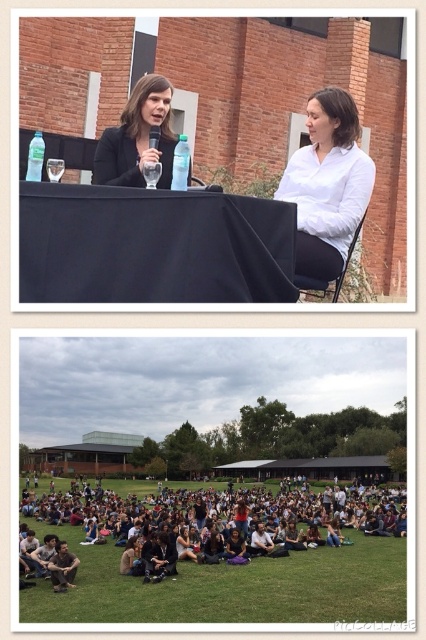
Is point (334, 236) positioned after point (51, 180)?

No, it is in front of (51, 180).

The image size is (426, 640). I want to click on white matte shirt at center, so click(328, 184).

At what (x,y) coordinates should I click in order to perform the action: click on white matte shirt at center. Please return your answer as a coordinate pair (x, y). Looking at the image, I should click on [x=328, y=184].

Which of these two, white matte shirt at center or clear plastic bottle at center, stands taller?

clear plastic bottle at center

Is white matte shirt at center below clear plastic bottle at center?

Yes.

Is point (316, 198) positioned after point (184, 157)?

Yes, it is.

Find the location of a particular element. Image resolution: width=426 pixels, height=640 pixels. white matte shirt at center is located at coordinates pyautogui.click(x=328, y=184).

Which is behind, point (140, 99) or point (175, 168)?

The point (140, 99) is more distant.

Measure the distance between matte black jacket at upper left and camera.

matte black jacket at upper left is 111.15 feet from camera.

Where is `matte black jacket at upper left`? The image size is (426, 640). matte black jacket at upper left is located at coordinates point(138,138).

Find the location of a particular element. This screenshot has width=426, height=640. matte black jacket at upper left is located at coordinates (138, 138).